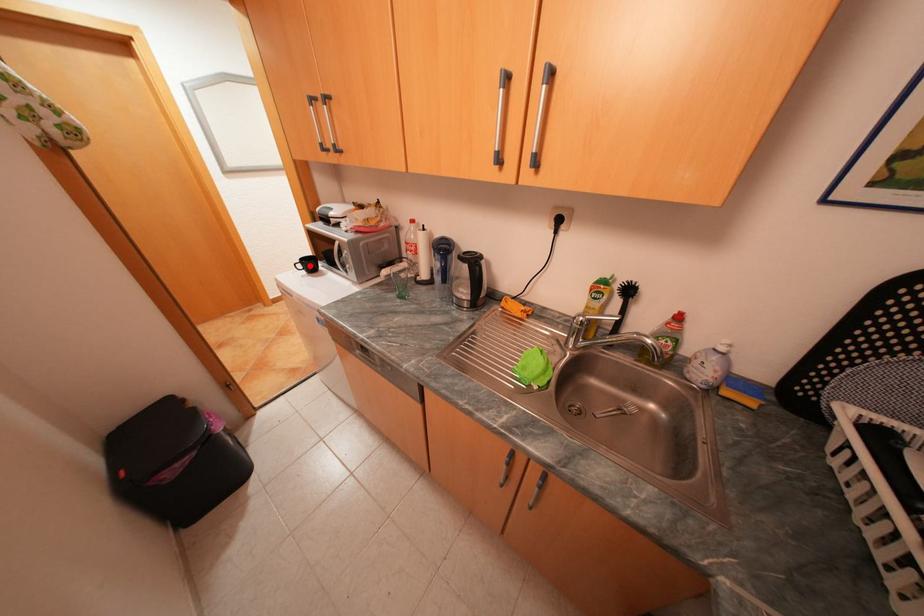
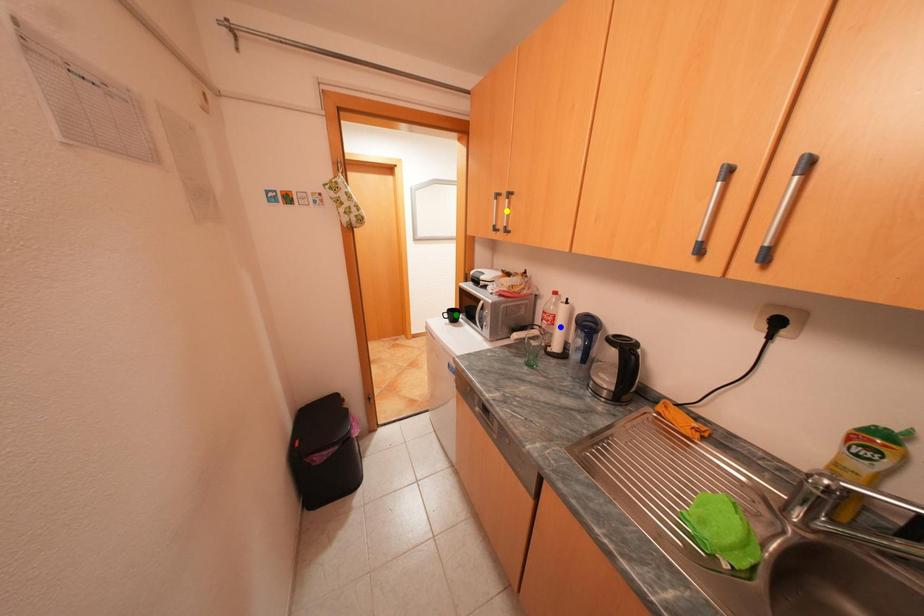
Question: I am providing you with two images of the same scene from different viewpoints. A red point is marked on the first image. You are given multiple points on the second image. Which point in image 2 represents the same 3d spot as the red point in image 1?

Choices:
 (A) green point
 (B) blue point
 (C) yellow point

Answer: (A)